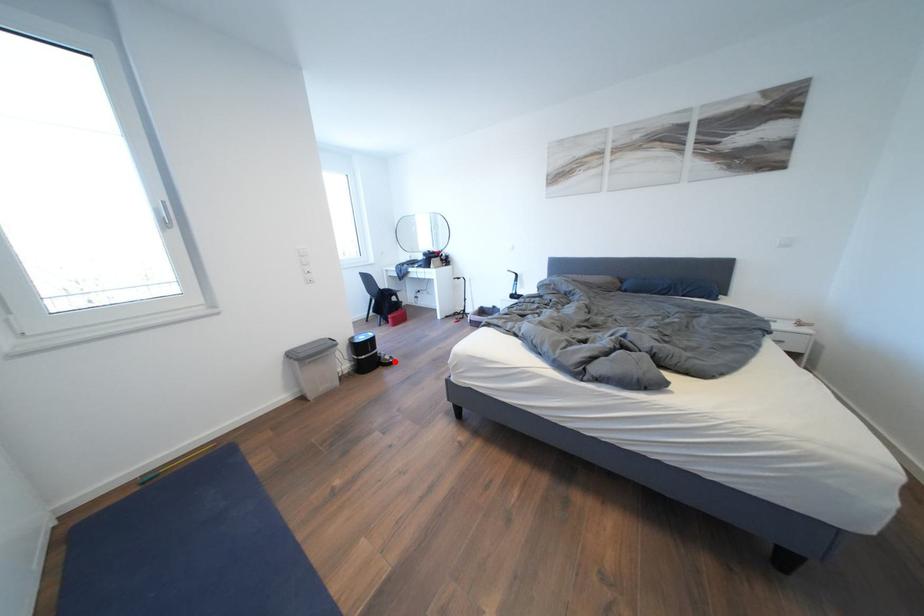
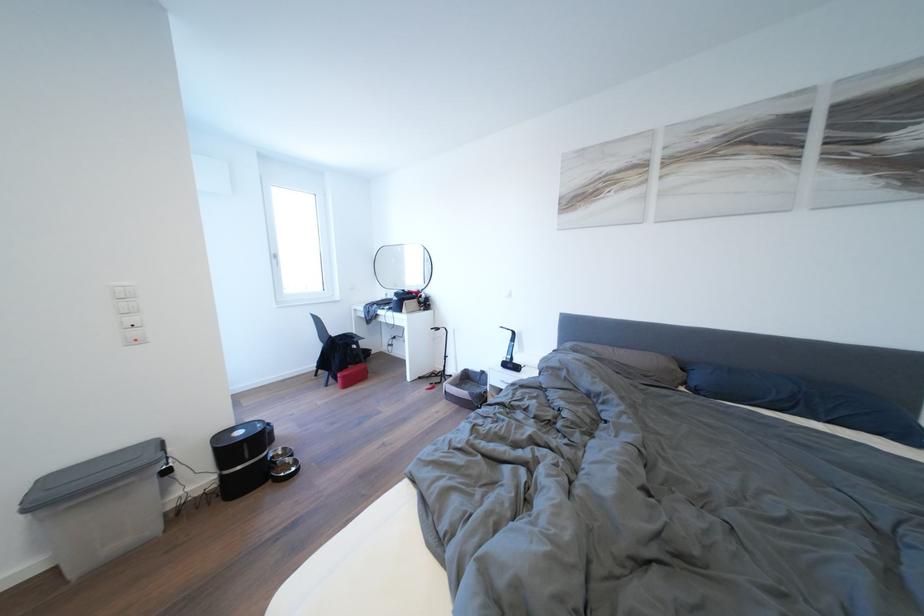
Question: I am providing you with two images of the same scene from different viewpoints. A red point is marked on the first image. Is the red point's position out of view in image 2?

Choices:
 (A) Yes
 (B) No

Answer: (B)